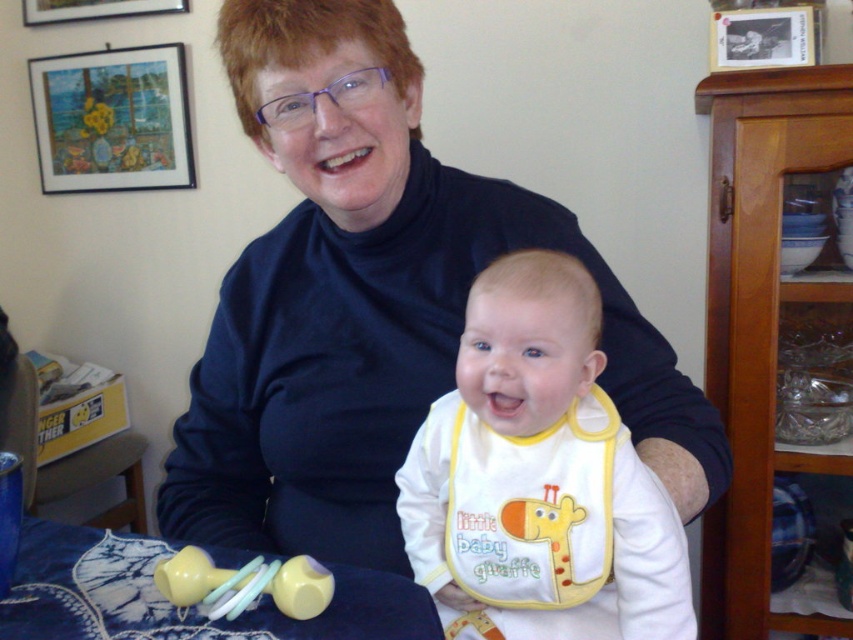
Question: Can you confirm if white soft bib at center is bigger than matte yellow plastic rattle at lower left?

Choices:
 (A) yes
 (B) no

Answer: (A)

Question: Among these points, which one is farthest from the camera?

Choices:
 (A) click(x=314, y=560)
 (B) click(x=614, y=600)
 (C) click(x=798, y=42)
 (D) click(x=404, y=561)

Answer: (C)

Question: Among these points, which one is nearest to the camera?

Choices:
 (A) (140, 1)
 (B) (213, 566)
 (C) (784, 44)

Answer: (B)

Question: Is matte yellow plastic rattle at lower left above metallic silver photo frame at upper right?

Choices:
 (A) yes
 (B) no

Answer: (B)

Question: Among these objects, which one is farthest from the camera?

Choices:
 (A) matte yellow plastic rattle at lower left
 (B) white/yellow fabric bib at center
 (C) wooden picture frame at upper left

Answer: (C)

Question: Is framed canvas at upper left to the right of wooden picture frame at upper left from the viewer's perspective?

Choices:
 (A) no
 (B) yes

Answer: (A)